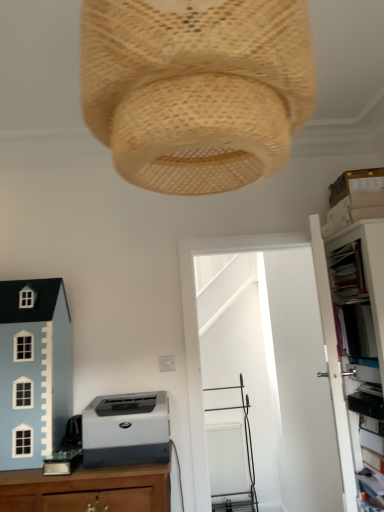
Question: From a real-world perspective, does woven beige lampshade at upper center stand above light blue painted wood toy house at lower left?

Choices:
 (A) yes
 (B) no

Answer: (A)

Question: Considering the relative sizes of woven beige lampshade at upper center and light blue painted wood toy house at lower left in the image provided, is woven beige lampshade at upper center smaller than light blue painted wood toy house at lower left?

Choices:
 (A) yes
 (B) no

Answer: (B)

Question: Is woven beige lampshade at upper center further to camera compared to light blue painted wood toy house at lower left?

Choices:
 (A) yes
 (B) no

Answer: (B)

Question: Can you confirm if woven beige lampshade at upper center is shorter than light blue painted wood toy house at lower left?

Choices:
 (A) no
 (B) yes

Answer: (B)

Question: Does woven beige lampshade at upper center have a lesser width compared to light blue painted wood toy house at lower left?

Choices:
 (A) no
 (B) yes

Answer: (A)

Question: Looking at their shapes, would you say light blue painted wood toy house at lower left is wider or thinner than gray matte printer at lower left?

Choices:
 (A) wide
 (B) thin

Answer: (B)

Question: Considering the positions of light blue painted wood toy house at lower left and gray matte printer at lower left in the image, is light blue painted wood toy house at lower left bigger or smaller than gray matte printer at lower left?

Choices:
 (A) small
 (B) big

Answer: (B)

Question: From a real-world perspective, is light blue painted wood toy house at lower left physically located above or below gray matte printer at lower left?

Choices:
 (A) above
 (B) below

Answer: (A)

Question: Is light blue painted wood toy house at lower left inside or outside of gray matte printer at lower left?

Choices:
 (A) inside
 (B) outside

Answer: (B)

Question: Does point pyautogui.click(x=142, y=435) appear closer or farther from the camera than point pyautogui.click(x=180, y=60)?

Choices:
 (A) closer
 (B) farther

Answer: (B)

Question: Which is correct: gray matte printer at lower left is inside woven beige lampshade at upper center, or outside of it?

Choices:
 (A) outside
 (B) inside

Answer: (A)

Question: From the image's perspective, is gray matte printer at lower left positioned above or below woven beige lampshade at upper center?

Choices:
 (A) below
 (B) above

Answer: (A)

Question: In the image, is gray matte printer at lower left on the left side or the right side of woven beige lampshade at upper center?

Choices:
 (A) left
 (B) right

Answer: (A)

Question: Is white plastic file cabinet at right bigger or smaller than light blue painted wood toy house at lower left?

Choices:
 (A) small
 (B) big

Answer: (B)

Question: Looking at their shapes, would you say white plastic file cabinet at right is wider or thinner than light blue painted wood toy house at lower left?

Choices:
 (A) thin
 (B) wide

Answer: (A)